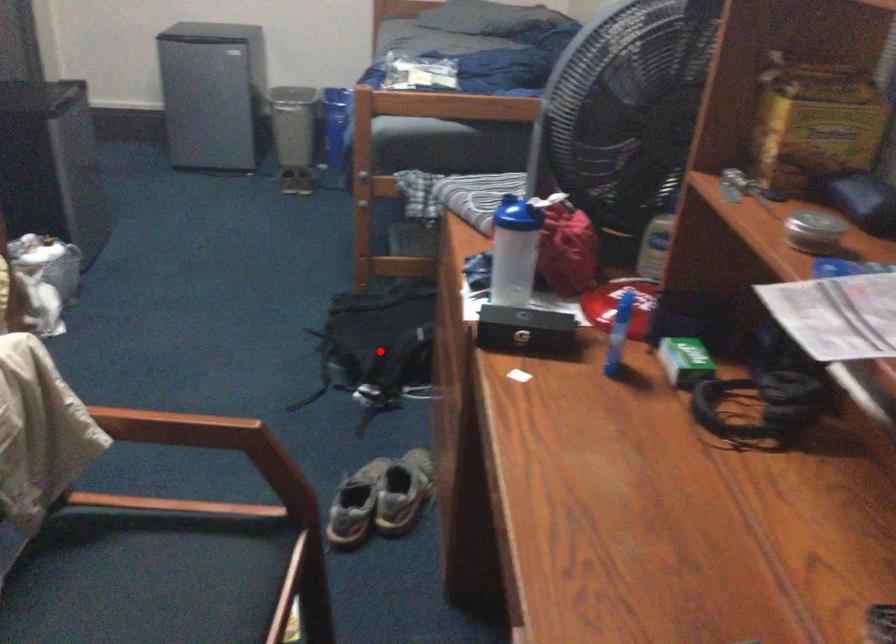
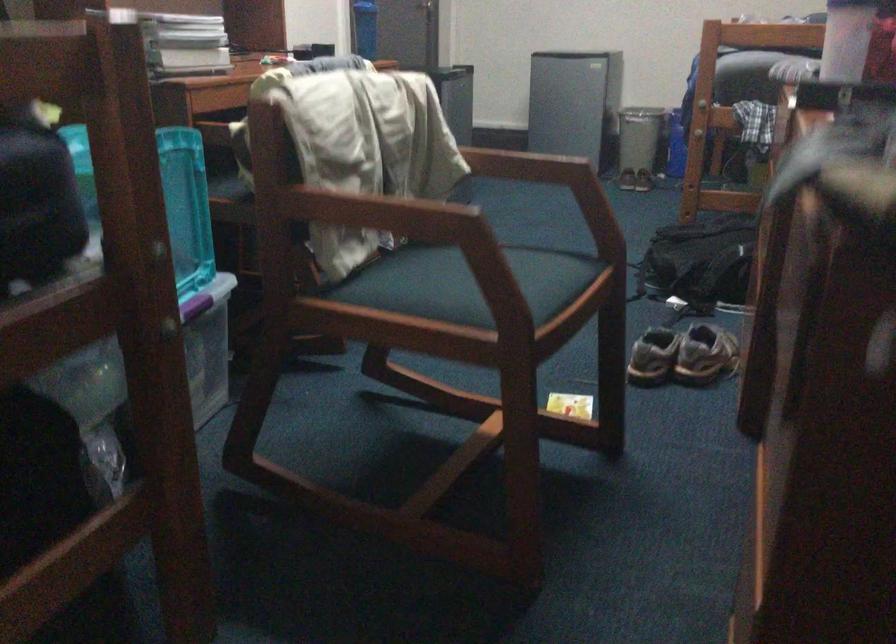
Find the pixel in the second image that matches the highlighted location in the first image.

(701, 260)